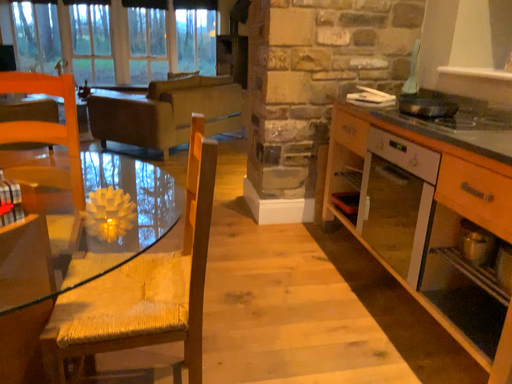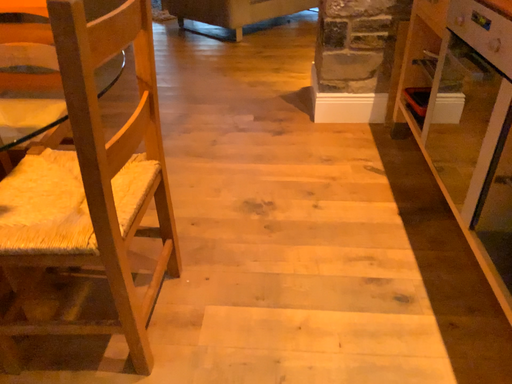
Question: Which way did the camera rotate in the video?

Choices:
 (A) rotated left
 (B) rotated right

Answer: (A)